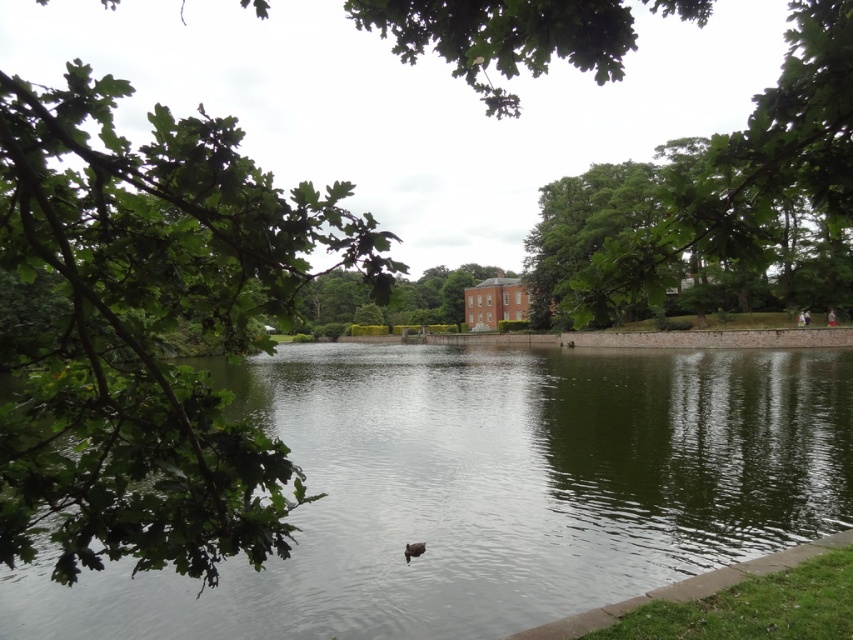
Question: In this image, where is green leafy branch at left located relative to green leafy tree at center?

Choices:
 (A) left
 (B) right

Answer: (A)

Question: Which object appears farthest from the camera in this image?

Choices:
 (A) brown fuzzy duck at center
 (B) green reflective water at center
 (C) green leafy tree at upper center

Answer: (A)

Question: Among these objects, which one is farthest from the camera?

Choices:
 (A) green leafy tree at upper center
 (B) brown fuzzy duck at center
 (C) green reflective water at center

Answer: (B)

Question: Which object is the closest to the green leafy branch at left?

Choices:
 (A) green leafy tree at center
 (B) brown fuzzy duck at center

Answer: (B)

Question: Is green leafy tree at upper center further to camera compared to green leafy tree at center?

Choices:
 (A) no
 (B) yes

Answer: (A)

Question: Does green reflective water at center have a larger size compared to green leafy branch at left?

Choices:
 (A) no
 (B) yes

Answer: (A)